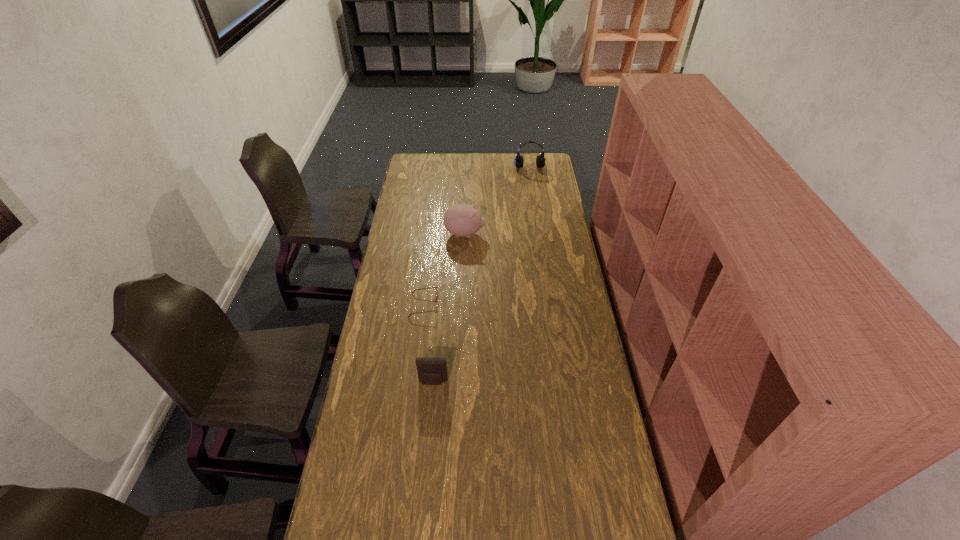
In order to click on the third closest object to the headset in this screenshot , I will do `click(431, 370)`.

Identify the location of object that is the closest to the second shortest object. This screenshot has width=960, height=540. (431, 287).

At what (x,y) coordinates should I click in order to perform the action: click on vacant area that satisfies the following two spatial constraints: 1. on the ear cushions of the headset; 2. on the face of the second nearest object. Please return your answer as a coordinate pair (x, y). Looking at the image, I should click on (550, 305).

Find the location of a particular element. free space that satisfies the following two spatial constraints: 1. on the ear cushions of the headset; 2. at the snout of the piggy bank is located at coordinates (540, 234).

Where is `vacant space that satisfies the following two spatial constraints: 1. on the ear cushions of the rightmost object; 2. on the face of the spectacles`? vacant space that satisfies the following two spatial constraints: 1. on the ear cushions of the rightmost object; 2. on the face of the spectacles is located at coordinates (550, 305).

Locate an element on the screen. This screenshot has width=960, height=540. vacant space that satisfies the following two spatial constraints: 1. at the snout of the second farthest object; 2. with an open flap on the pouch is located at coordinates (459, 382).

You are a GUI agent. You are given a task and a screenshot of the screen. Output one action in this format:
    pyautogui.click(x=<x>, y=<y>)
    Task: Click on the free location that satisfies the following two spatial constraints: 1. at the snout of the third nearest object; 2. with an open flap on the pouch
    
    Given the screenshot: What is the action you would take?
    pyautogui.click(x=459, y=382)